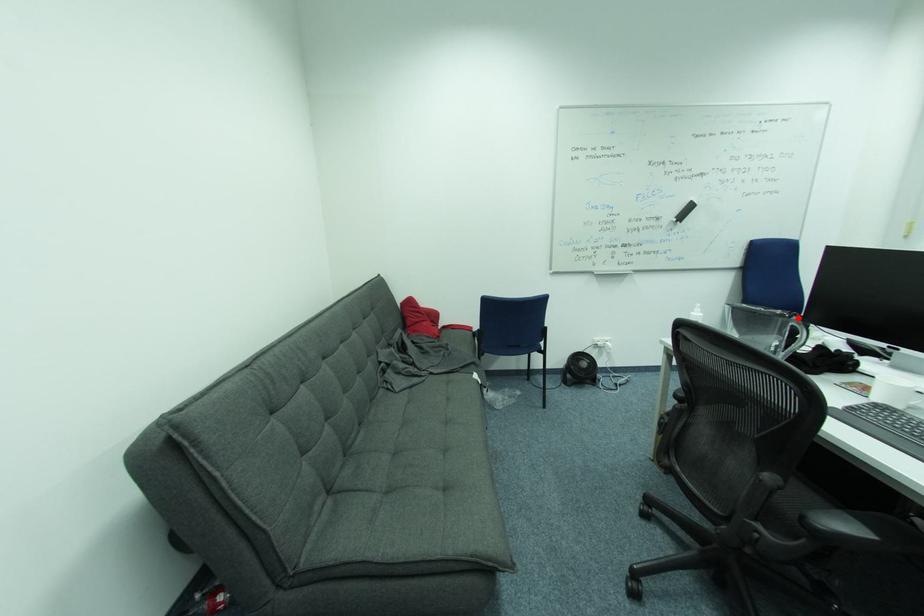
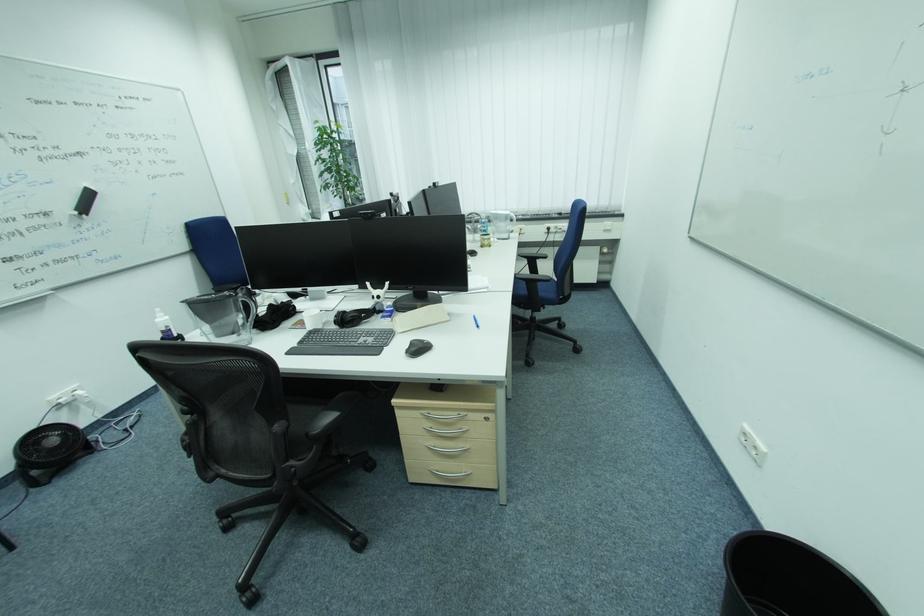
Question: I am providing you with two images of the same scene from different viewpoints. A red point is shown in image1. For the corresponding object point in image2, is it positioned nearer or farther from the camera?

Choices:
 (A) Nearer
 (B) Farther

Answer: (A)